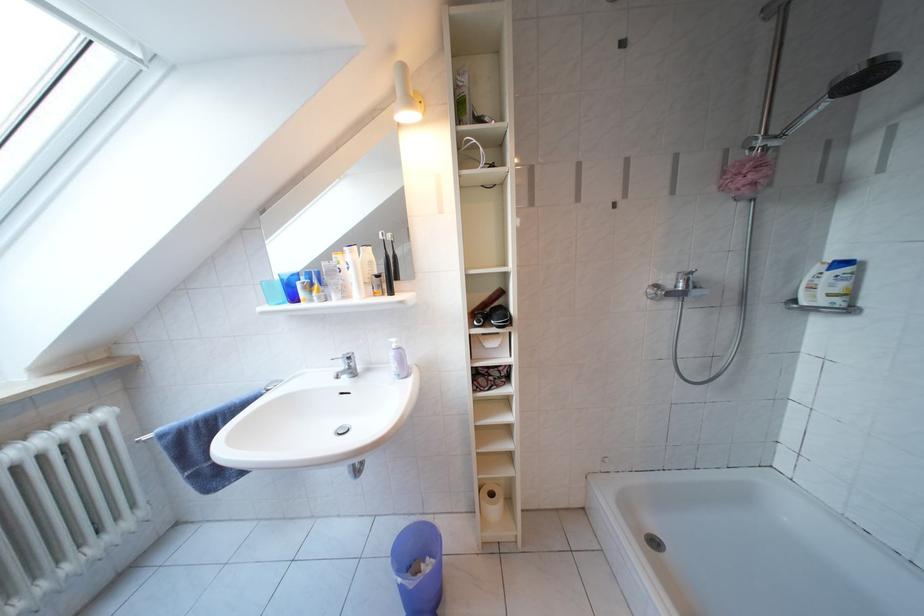
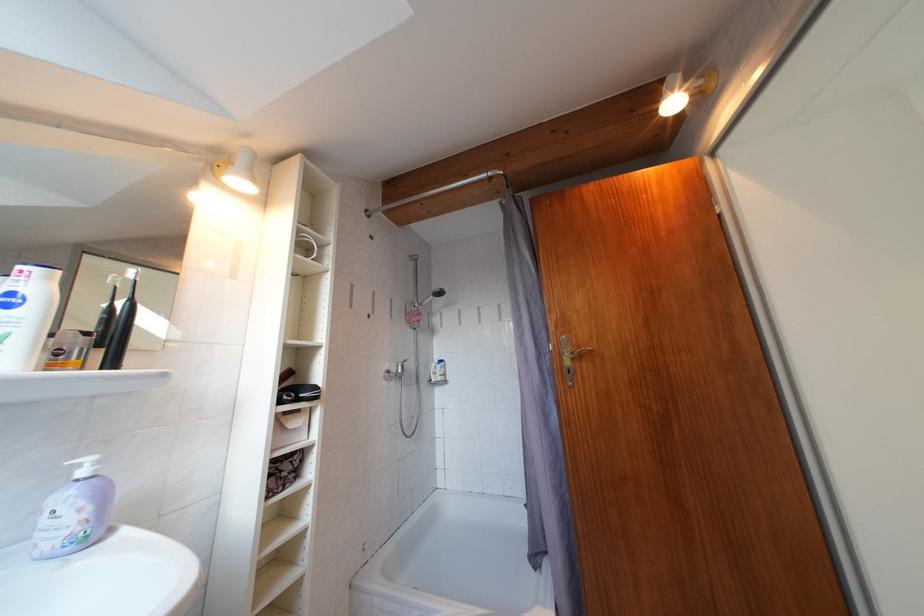
Where in the second image is the point corresponding to (x=402, y=351) from the first image?

(92, 477)